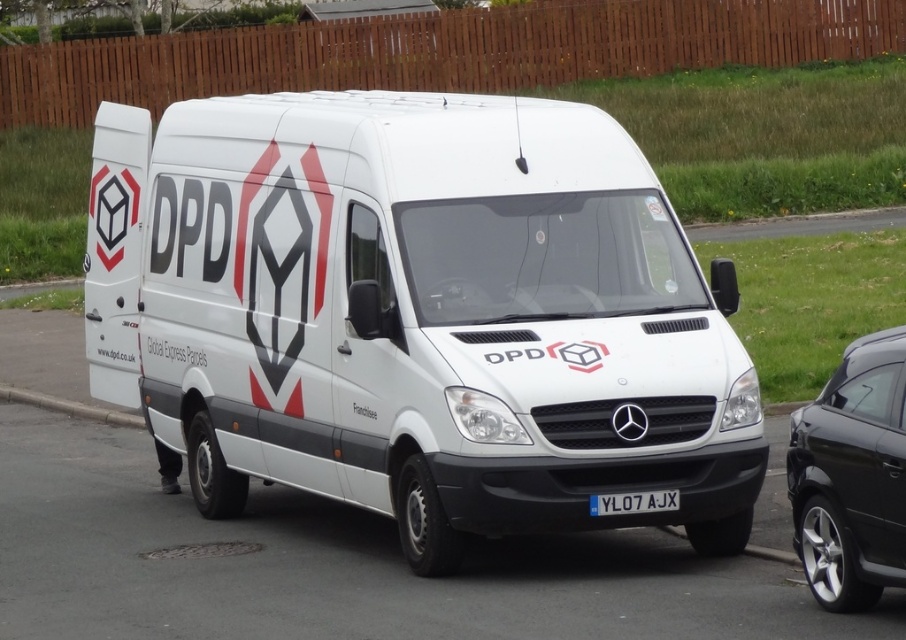
Between point (288, 413) and point (643, 509), which one is positioned in front?

Point (643, 509)

This screenshot has height=640, width=906. In order to click on white matte van at center in this screenshot , I will do `click(418, 314)`.

Is white matte van at center shorter than glossy black car at right?

Indeed, white matte van at center has a lesser height compared to glossy black car at right.

Can you confirm if white matte van at center is positioned above glossy black car at right?

Indeed, white matte van at center is positioned over glossy black car at right.

The width and height of the screenshot is (906, 640). What do you see at coordinates (418, 314) in the screenshot?
I see `white matte van at center` at bounding box center [418, 314].

The height and width of the screenshot is (640, 906). Identify the location of white matte van at center. (418, 314).

Is concrete at lower left to the left of white plastic license plate at center from the viewer's perspective?

Indeed, concrete at lower left is positioned on the left side of white plastic license plate at center.

Can you confirm if concrete at lower left is wider than white plastic license plate at center?

Yes, concrete at lower left is wider than white plastic license plate at center.

Is point (93, 413) positioned in front of point (615, 499)?

No, it is not.

Where is `concrete at lower left`? concrete at lower left is located at coordinates (69, 406).